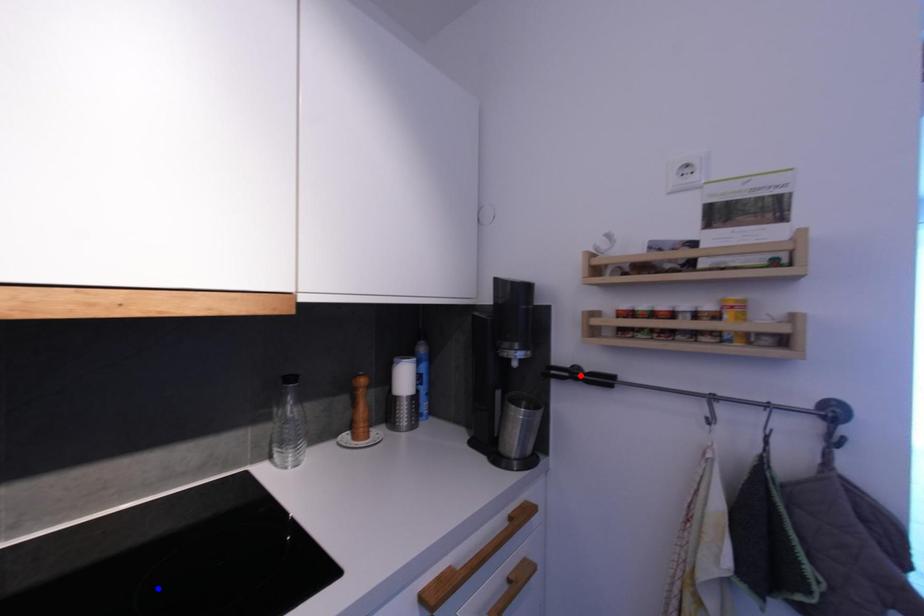
Question: Which of the two points in the image is closer to the camera?

Choices:
 (A) Blue point is closer.
 (B) Red point is closer.

Answer: (A)